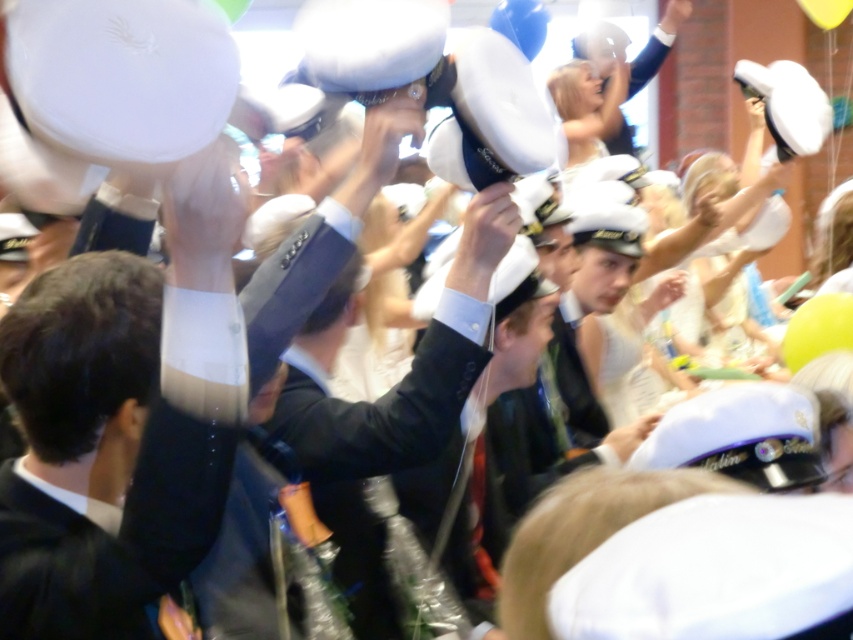
Does shiny black suit at center come in front of white matte balloon at upper left?

No, it is not.

Is shiny black suit at center to the right of white matte balloon at upper left from the viewer's perspective?

Incorrect, shiny black suit at center is not on the right side of white matte balloon at upper left.

Between point (136, 524) and point (82, 20), which one is positioned in front?

Point (82, 20)

Find the location of a particular element. shiny black suit at center is located at coordinates [160, 429].

Measure the distance from white matte balloon at upper center to blue rubber balloon at upper center.

white matte balloon at upper center is 5.76 meters away from blue rubber balloon at upper center.

Image resolution: width=853 pixels, height=640 pixels. What do you see at coordinates (368, 42) in the screenshot? I see `white matte balloon at upper center` at bounding box center [368, 42].

You are a GUI agent. You are given a task and a screenshot of the screen. Output one action in this format:
    pyautogui.click(x=<x>, y=<y>)
    Task: Click on the white matte balloon at upper center
    
    Given the screenshot: What is the action you would take?
    pyautogui.click(x=368, y=42)

Between point (183, 122) and point (440, 38), which one is positioned in front?

Point (183, 122)

Can you confirm if white matte balloon at upper left is taller than white matte balloon at upper center?

Yes.

Who is more distant from viewer, (132,54) or (387,40)?

Positioned behind is point (387,40).

Identify the location of white matte balloon at upper left. The image size is (853, 640). (122, 74).